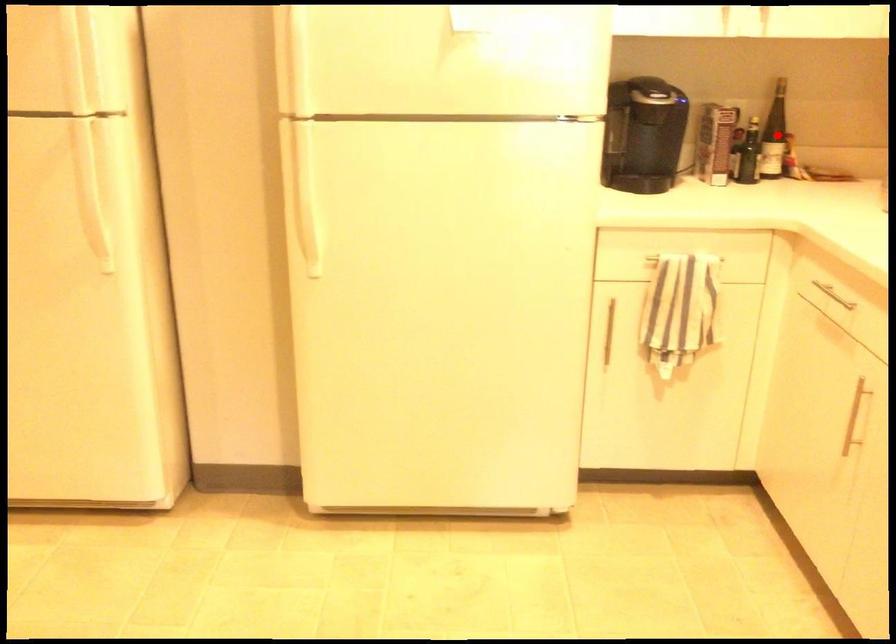
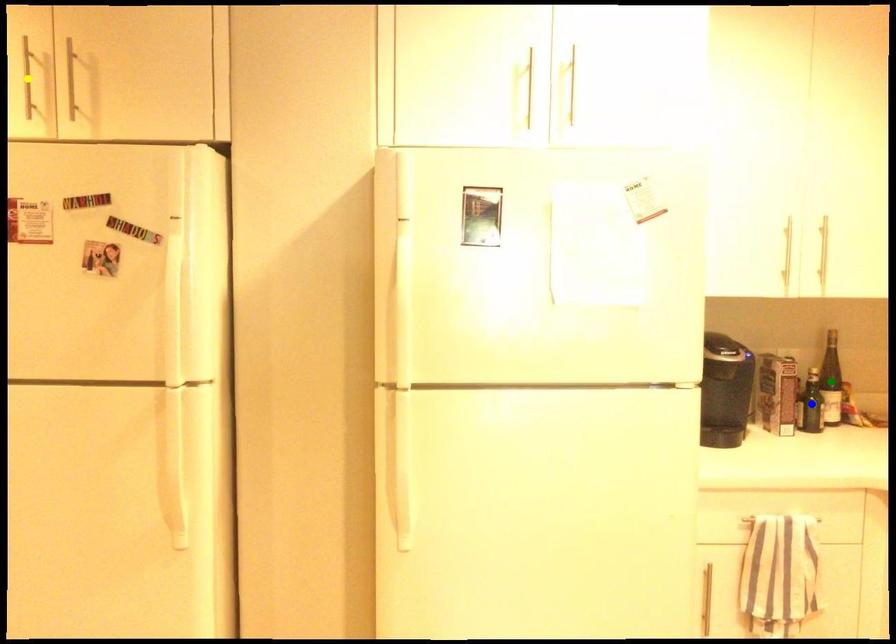
Question: I am providing you with two images of the same scene from different viewpoints. A red point is marked on the first image. You are given multiple points on the second image. Which point in image 2 is actually the same real-world point as the red point in image 1?

Choices:
 (A) green point
 (B) yellow point
 (C) blue point

Answer: (A)